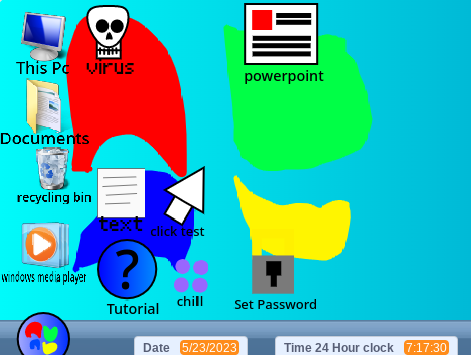
At what (x,y) coordinates should I click in order to perform the action: click on folder. Please return your answer as a coordinate pair (x, y). Looking at the image, I should click on (33, 107), (32, 97), (47, 88).